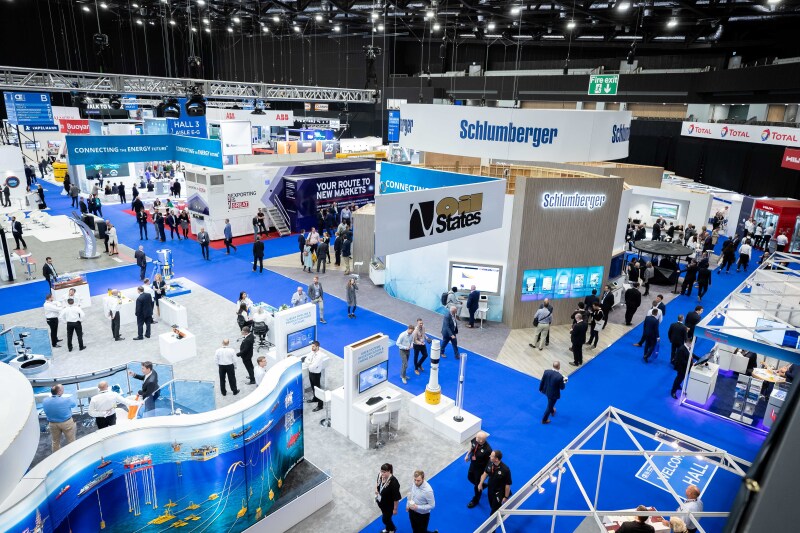
Where is `schlumberger's partition wall`? schlumberger's partition wall is located at coordinates (564, 233).